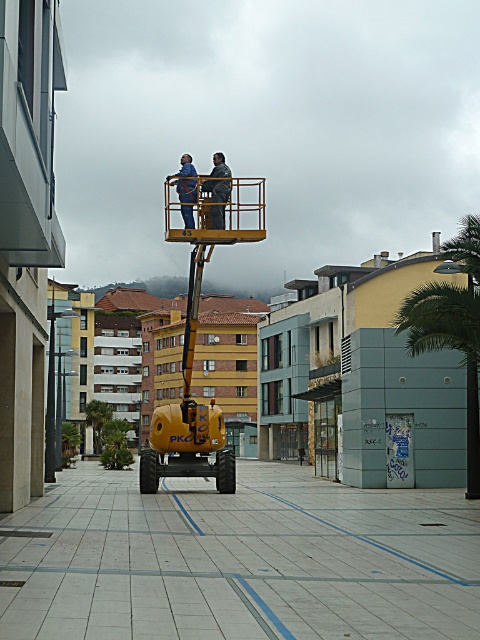
Question: Is yellow rubber construction vehicle at center behind green leafy palm tree at center?

Choices:
 (A) no
 (B) yes

Answer: (A)

Question: Among these points, which one is nearest to the camera?

Choices:
 (A) (17, 552)
 (B) (104, 417)
 (C) (463, 316)
 (D) (217, 468)

Answer: (A)

Question: Can you confirm if yellow rubber construction vehicle at center is positioned above yellow metallic forklift at center?

Choices:
 (A) yes
 (B) no

Answer: (B)

Question: Where is green leafy palm tree at right located in relation to green leafy palm tree at center in the image?

Choices:
 (A) below
 (B) above

Answer: (B)

Question: Which object is positioned farthest from the green leafy palm tree at right?

Choices:
 (A) yellow metallic forklift at center
 (B) yellow rubber construction vehicle at center
 (C) green leafy palm tree at center

Answer: (C)

Question: Based on their relative distances, which object is farther from the green leafy palm tree at center?

Choices:
 (A) green leafy palm tree at right
 (B) yellow metallic forklift at center

Answer: (A)